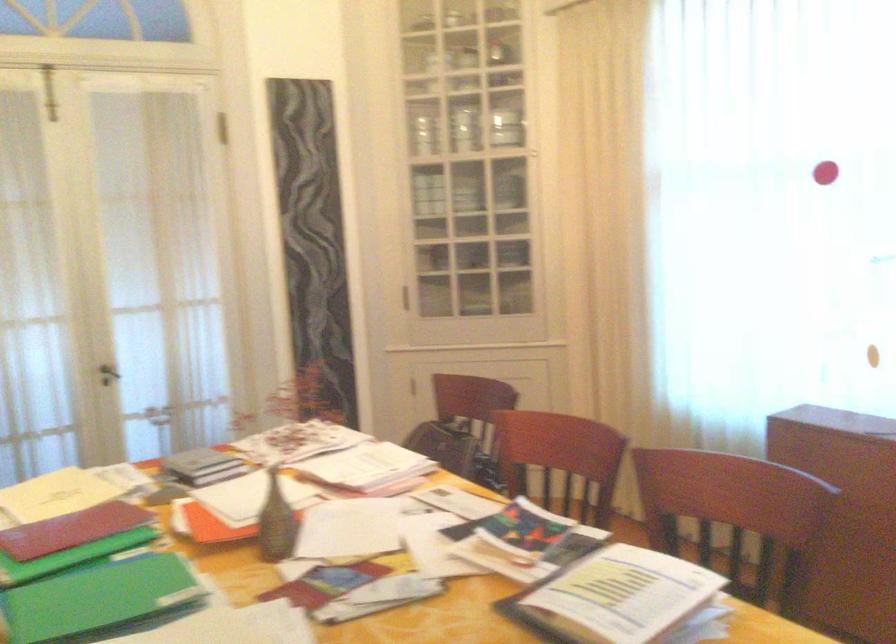
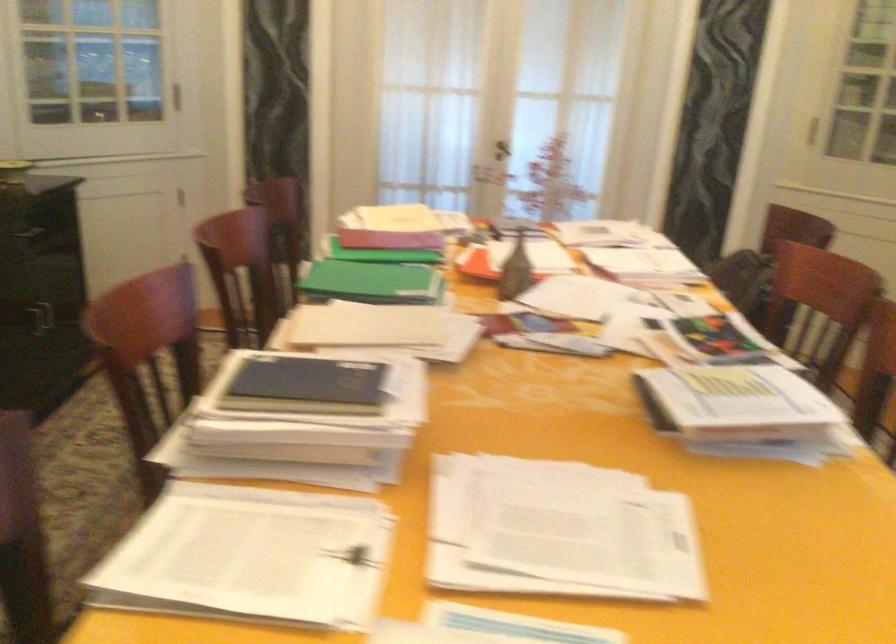
Based on the continuous images, in which direction is the camera rotating?

The camera's rotation is toward left-down.